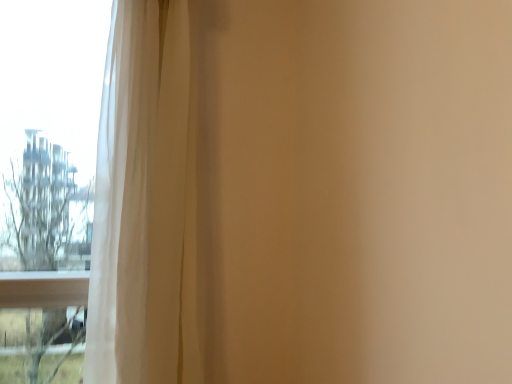
Question: Is white sheer curtain at left in front of transparent glass window at left?

Choices:
 (A) yes
 (B) no

Answer: (A)

Question: Is white sheer curtain at left aimed at transparent glass window at left?

Choices:
 (A) no
 (B) yes

Answer: (A)

Question: Is white sheer curtain at left not within transparent glass window at left?

Choices:
 (A) yes
 (B) no

Answer: (A)

Question: Considering the relative positions of white sheer curtain at left and transparent glass window at left in the image provided, is white sheer curtain at left to the right of transparent glass window at left from the viewer's perspective?

Choices:
 (A) no
 (B) yes

Answer: (B)

Question: Does white sheer curtain at left have a larger size compared to transparent glass window at left?

Choices:
 (A) yes
 (B) no

Answer: (A)

Question: Can you see white sheer curtain at left touching transparent glass window at left?

Choices:
 (A) no
 (B) yes

Answer: (A)

Question: Is transparent glass window at left bigger than white sheer curtain at left?

Choices:
 (A) no
 (B) yes

Answer: (A)

Question: Is the position of transparent glass window at left more distant than that of white sheer curtain at left?

Choices:
 (A) no
 (B) yes

Answer: (B)

Question: Is transparent glass window at left smaller than white sheer curtain at left?

Choices:
 (A) yes
 (B) no

Answer: (A)

Question: Is transparent glass window at left next to white sheer curtain at left?

Choices:
 (A) yes
 (B) no

Answer: (B)

Question: Can you confirm if transparent glass window at left is thinner than white sheer curtain at left?

Choices:
 (A) no
 (B) yes

Answer: (A)

Question: From a real-world perspective, is transparent glass window at left beneath white sheer curtain at left?

Choices:
 (A) no
 (B) yes

Answer: (A)

Question: Looking at the image, does transparent glass window at left seem bigger or smaller compared to white sheer curtain at left?

Choices:
 (A) small
 (B) big

Answer: (A)